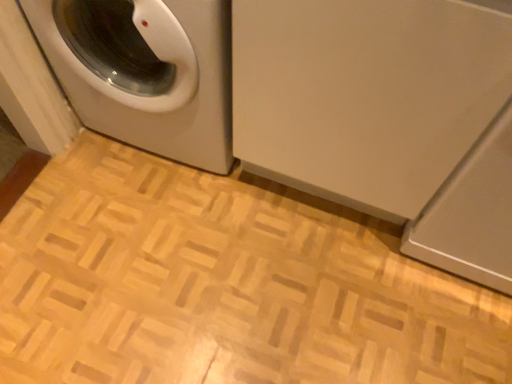
Question: Is white glossy washing machine at left, the 2th washing machine when ordered from right to left, wider than white glossy washing machine at upper left, marked as the first washing machine in a right-to-left arrangement?

Choices:
 (A) yes
 (B) no

Answer: (B)

Question: Considering the relative sizes of white glossy washing machine at left, which is counted as the 1th washing machine, starting from the left, and white glossy washing machine at upper left, the second washing machine when ordered from left to right, in the image provided, is white glossy washing machine at left, which is counted as the 1th washing machine, starting from the left, thinner than white glossy washing machine at upper left, the second washing machine when ordered from left to right,?

Choices:
 (A) no
 (B) yes

Answer: (B)

Question: Can we say white glossy washing machine at left, the 2th washing machine when ordered from right to left, lies outside white glossy washing machine at upper left, the second washing machine when ordered from left to right?

Choices:
 (A) no
 (B) yes

Answer: (A)

Question: Is white glossy washing machine at left, the 2th washing machine when ordered from right to left, smaller than white glossy washing machine at upper left, the second washing machine when ordered from left to right?

Choices:
 (A) no
 (B) yes

Answer: (B)

Question: Is the surface of white glossy washing machine at left, which is counted as the 1th washing machine, starting from the left, in direct contact with white glossy washing machine at upper left, the second washing machine when ordered from left to right?

Choices:
 (A) no
 (B) yes

Answer: (A)

Question: Does white glossy washing machine at left, which is counted as the 1th washing machine, starting from the left, come in front of white glossy washing machine at upper left, the second washing machine when ordered from left to right?

Choices:
 (A) yes
 (B) no

Answer: (B)

Question: Is white glossy washing machine at upper left, the second washing machine when ordered from left to right, taller than white glossy washing machine at left, the 2th washing machine when ordered from right to left?

Choices:
 (A) no
 (B) yes

Answer: (B)

Question: Considering the relative positions of white glossy washing machine at upper left, the second washing machine when ordered from left to right, and white glossy washing machine at left, which is counted as the 1th washing machine, starting from the left, in the image provided, is white glossy washing machine at upper left, the second washing machine when ordered from left to right, in front of white glossy washing machine at left, which is counted as the 1th washing machine, starting from the left,?

Choices:
 (A) yes
 (B) no

Answer: (A)

Question: From the image's perspective, would you say white glossy washing machine at upper left, marked as the first washing machine in a right-to-left arrangement, is shown under white glossy washing machine at left, which is counted as the 1th washing machine, starting from the left?

Choices:
 (A) no
 (B) yes

Answer: (B)

Question: Is white glossy washing machine at upper left, the second washing machine when ordered from left to right, further to camera compared to white glossy washing machine at left, which is counted as the 1th washing machine, starting from the left?

Choices:
 (A) yes
 (B) no

Answer: (B)

Question: Is white glossy washing machine at upper left, marked as the first washing machine in a right-to-left arrangement, wider than white glossy washing machine at left, the 2th washing machine when ordered from right to left?

Choices:
 (A) yes
 (B) no

Answer: (A)

Question: Does white glossy washing machine at upper left, the second washing machine when ordered from left to right, have a larger size compared to white glossy washing machine at left, the 2th washing machine when ordered from right to left?

Choices:
 (A) yes
 (B) no

Answer: (A)

Question: From a real-world perspective, is white glossy washing machine at upper left, marked as the first washing machine in a right-to-left arrangement, positioned above or below white glossy washing machine at left, the 2th washing machine when ordered from right to left?

Choices:
 (A) above
 (B) below

Answer: (A)